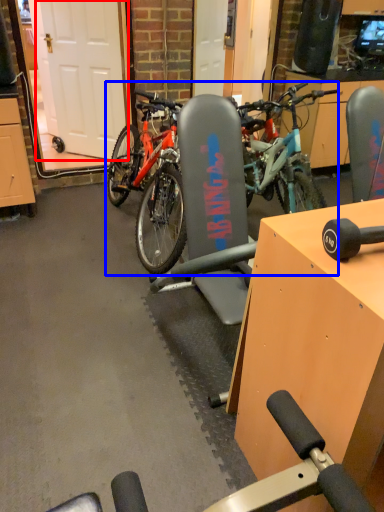
Question: Which object is closer to the camera taking this photo, garage door (highlighted by a red box) or bicycle (highlighted by a blue box)?

Choices:
 (A) garage door
 (B) bicycle

Answer: (B)